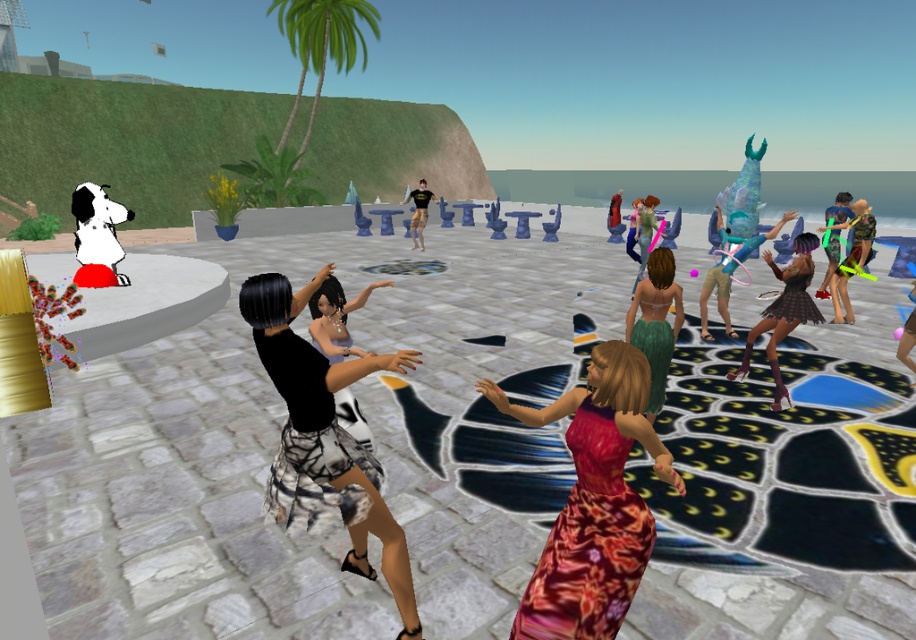
Question: Among these objects, which one is farthest from the camera?

Choices:
 (A) green textured skirt at center
 (B) plaid skirt at center
 (C) teal fabric dress at center

Answer: (C)

Question: Does plaid skirt at center come behind metallic silver bikini at right?

Choices:
 (A) no
 (B) yes

Answer: (A)

Question: Which point is farther to the camera?

Choices:
 (A) (727, 259)
 (B) (322, 404)
 (C) (646, 349)
 (D) (786, 301)

Answer: (A)

Question: Which object is farther from the camera taking this photo?

Choices:
 (A) black matte shirt at center
 (B) neon green fabric dress at right
 (C) teal fabric dress at center
 (D) green satin dress at center

Answer: (A)

Question: Observing the image, what is the correct spatial positioning of green satin dress at center in reference to black matte shirt at center?

Choices:
 (A) below
 (B) above

Answer: (A)

Question: Can you confirm if metallic silver bikini at right is positioned to the left of green fabric dress at center?

Choices:
 (A) no
 (B) yes

Answer: (A)